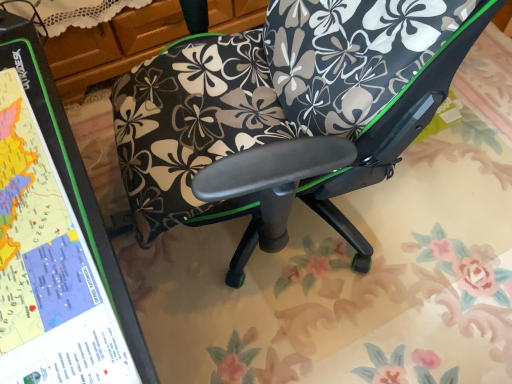
Question: Is floral-patterned fabric chair at center placed right next to green matte map at left?

Choices:
 (A) no
 (B) yes

Answer: (A)

Question: Is floral-patterned fabric chair at center at the right side of green matte map at left?

Choices:
 (A) no
 (B) yes

Answer: (B)

Question: Considering the relative sizes of floral-patterned fabric chair at center and green matte map at left in the image provided, is floral-patterned fabric chair at center bigger than green matte map at left?

Choices:
 (A) yes
 (B) no

Answer: (A)

Question: From the image's perspective, would you say floral-patterned fabric chair at center is shown under green matte map at left?

Choices:
 (A) yes
 (B) no

Answer: (B)

Question: Can you confirm if floral-patterned fabric chair at center is wider than green matte map at left?

Choices:
 (A) no
 (B) yes

Answer: (B)

Question: Is floral-patterned fabric chair at center not near green matte map at left?

Choices:
 (A) yes
 (B) no

Answer: (B)

Question: Is green matte map at left to the right of floral-patterned fabric chair at center from the viewer's perspective?

Choices:
 (A) no
 (B) yes

Answer: (A)

Question: Can you confirm if green matte map at left is bigger than floral-patterned fabric chair at center?

Choices:
 (A) no
 (B) yes

Answer: (A)

Question: Would you say floral-patterned fabric chair at center is part of green matte map at left's contents?

Choices:
 (A) yes
 (B) no

Answer: (B)

Question: Can you confirm if green matte map at left is positioned to the left of floral-patterned fabric chair at center?

Choices:
 (A) yes
 (B) no

Answer: (A)

Question: Can you confirm if green matte map at left is taller than floral-patterned fabric chair at center?

Choices:
 (A) yes
 (B) no

Answer: (B)

Question: Is green matte map at left wider than floral-patterned fabric chair at center?

Choices:
 (A) yes
 (B) no

Answer: (B)

Question: From the image's perspective, is green matte map at left above or below floral-patterned fabric chair at center?

Choices:
 (A) below
 (B) above

Answer: (A)